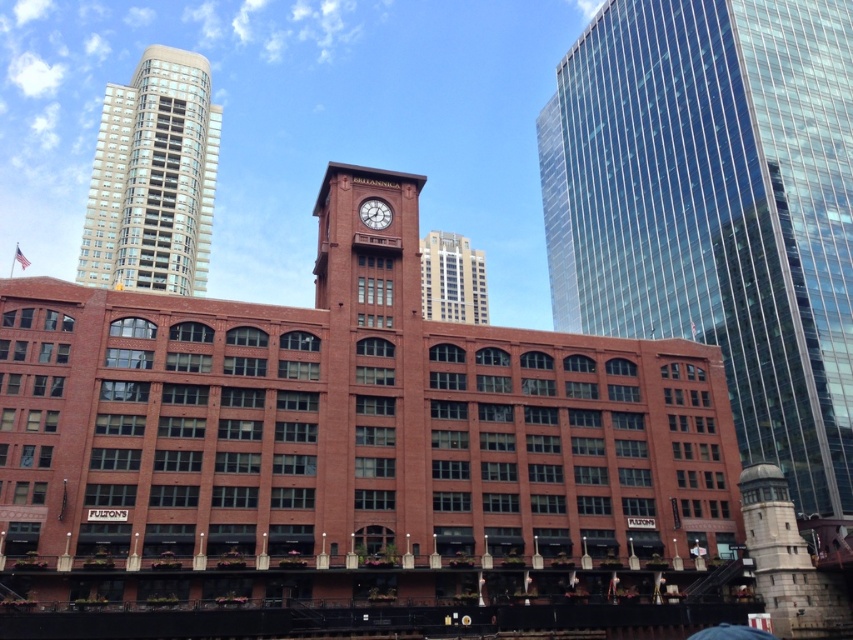
Looking at this image, you are standing in front of the historic red brick building with the clock tower. You notice two points marked on the building. The first point is at coordinates point (722, 196) and the second is at point (384, 202). If you were to walk towards the building, which point would you reach first?

The point at (722, 196) is closer to the viewer, so you would reach it first when walking towards the building.

You are an architect assessing the skyline of the city. You notice the beige glassy building at upper left and the glassy reflective skyscraper at upper center. Which of these two buildings has a greater width in the image?

The beige glassy building at upper left has a greater width than the glassy reflective skyscraper at upper center according to the description.